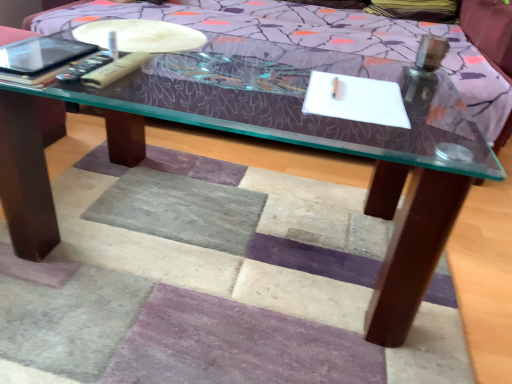
Question: From the image's perspective, is matte black tablet at upper left over beige plastic remote at upper left, which appears as the second remote when viewed from the left?

Choices:
 (A) yes
 (B) no

Answer: (A)

Question: Is matte black tablet at upper left taller than beige plastic remote at upper left, which appears as the second remote when viewed from the left?

Choices:
 (A) no
 (B) yes

Answer: (A)

Question: Is matte black tablet at upper left thinner than beige plastic remote at upper left, the first remote from the right?

Choices:
 (A) no
 (B) yes

Answer: (A)

Question: From a real-world perspective, is matte black tablet at upper left over beige plastic remote at upper left, the first remote from the right?

Choices:
 (A) yes
 (B) no

Answer: (A)

Question: Is matte black tablet at upper left with beige plastic remote at upper left, which appears as the second remote when viewed from the left?

Choices:
 (A) no
 (B) yes

Answer: (A)

Question: In terms of size, does matte black tablet at upper left appear bigger or smaller than black plastic remote at left, which ranks as the 1th remote in left-to-right order?

Choices:
 (A) big
 (B) small

Answer: (A)

Question: Is point (35, 72) closer or farther from the camera than point (75, 64)?

Choices:
 (A) farther
 (B) closer

Answer: (B)

Question: Is matte black tablet at upper left inside or outside of black plastic remote at left, placed as the second remote when sorted from right to left?

Choices:
 (A) inside
 (B) outside

Answer: (B)

Question: Considering the relative positions of matte black tablet at upper left and black plastic remote at left, which ranks as the 1th remote in left-to-right order, in the image provided, is matte black tablet at upper left to the left or to the right of black plastic remote at left, which ranks as the 1th remote in left-to-right order,?

Choices:
 (A) left
 (B) right

Answer: (A)

Question: From the image's perspective, relative to matte plastic remote control at upper left, is black plastic remote at left, placed as the second remote when sorted from right to left, above or below?

Choices:
 (A) above
 (B) below

Answer: (B)

Question: Is black plastic remote at left, placed as the second remote when sorted from right to left, situated inside matte plastic remote control at upper left or outside?

Choices:
 (A) outside
 (B) inside

Answer: (A)

Question: Visually, is black plastic remote at left, which ranks as the 1th remote in left-to-right order, positioned to the left or to the right of matte plastic remote control at upper left?

Choices:
 (A) left
 (B) right

Answer: (A)

Question: Is black plastic remote at left, which ranks as the 1th remote in left-to-right order, wider or thinner than matte plastic remote control at upper left?

Choices:
 (A) wide
 (B) thin

Answer: (B)

Question: Visually, is matte plastic remote control at upper left positioned to the left or to the right of matte black tablet at upper left?

Choices:
 (A) left
 (B) right

Answer: (B)

Question: Looking at their shapes, would you say matte plastic remote control at upper left is wider or thinner than matte black tablet at upper left?

Choices:
 (A) wide
 (B) thin

Answer: (A)